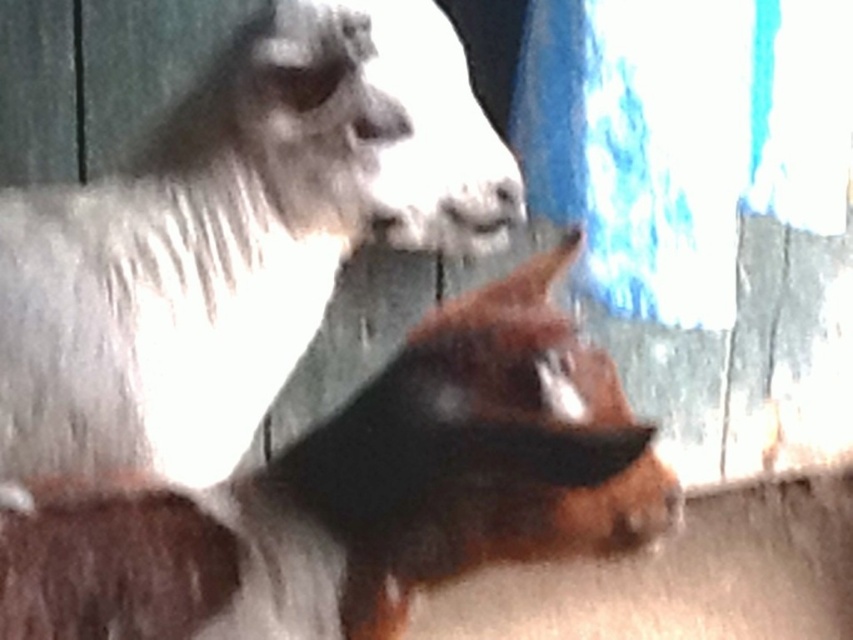
You are standing in a barn and see two points marked in the image. The first point is at coordinate point (50, 364) and the second is at point (74, 609). Which point is closer to you?

Point (50, 364) is further to the camera than point (74, 609), so the second point is closer to you.

Looking at this image, you are a farmer who wants to separate the brown woolen sheep at center and the brown furry dog at center into two different pens. The minimum required distance between the two pens is 12 inches. Based on the current distance between them, can you place them in separate pens without violating the distance requirement?

The distance between the brown woolen sheep at center and the brown furry dog at center is 13.46 inches, which exceeds the minimum required distance of 12 inches. Therefore, you can safely place them in separate pens without violating the distance requirement.

You are a photographer standing in a field and see the brown woolen sheep at center. If you want to take a clear photo of the sheep, should you move closer or farther away from the sheep?

The brown woolen sheep at center is 1.38 meters from viewer. Since the sheep is already close, you should move farther away to ensure the entire sheep fits in the frame without being too blurry.